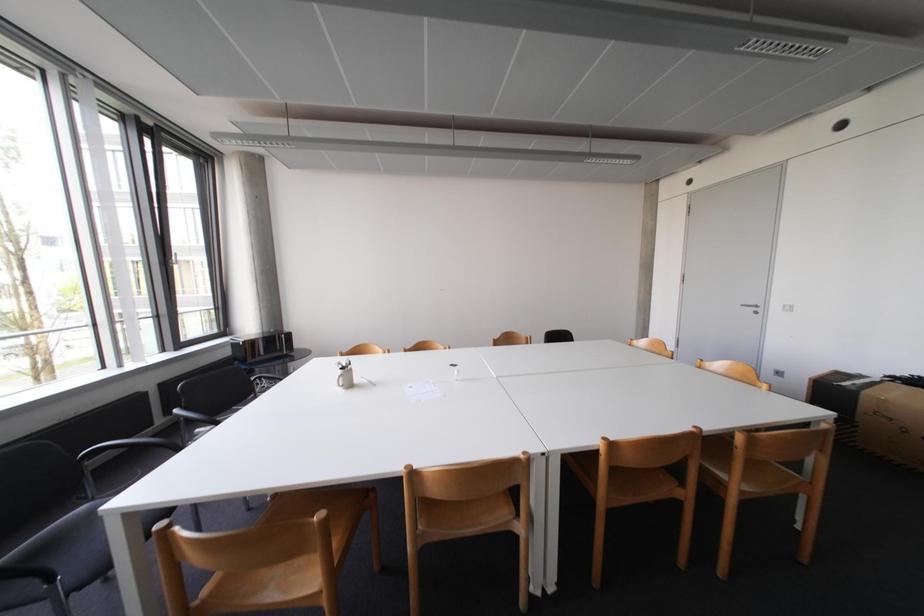
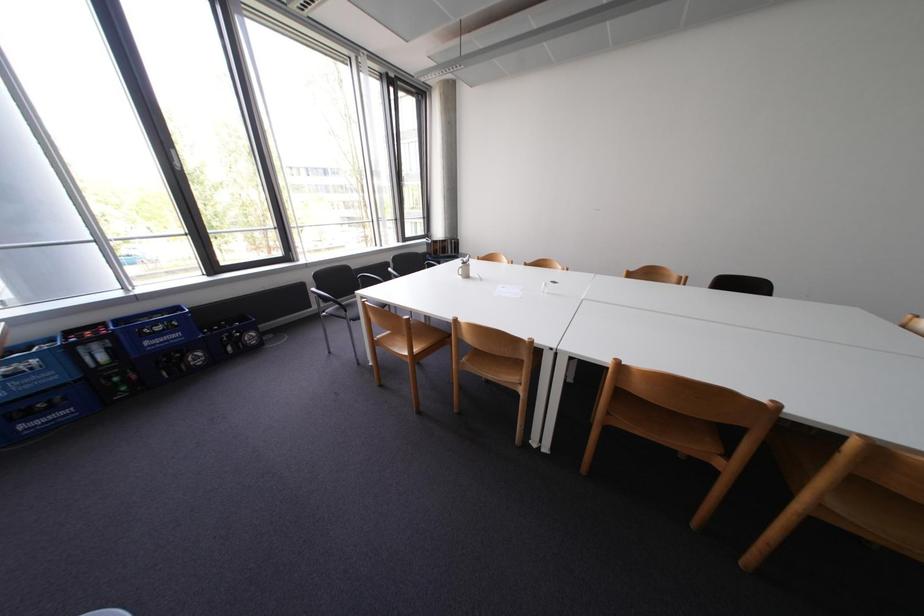
How did the camera likely rotate?

The camera's rotation is toward left-down.